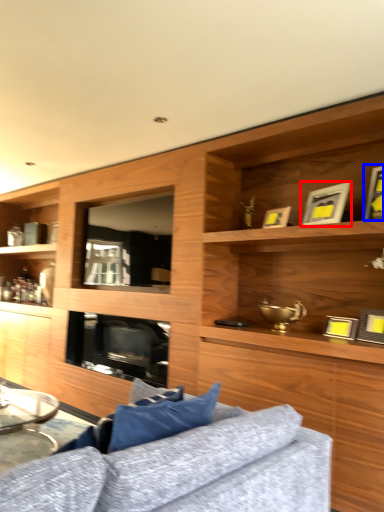
Question: Among these objects, which one is farthest to the camera, picture frame (highlighted by a red box) or picture frame (highlighted by a blue box)?

Choices:
 (A) picture frame
 (B) picture frame

Answer: (A)